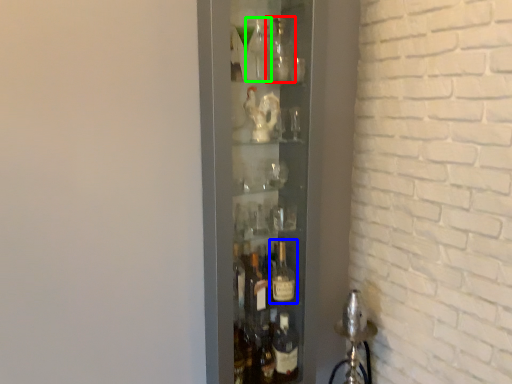
Question: Considering the real-world distances, which object is farthest from bottle (highlighted by a red box)? bottle (highlighted by a blue box) or bottle (highlighted by a green box)?

Choices:
 (A) bottle
 (B) bottle

Answer: (A)